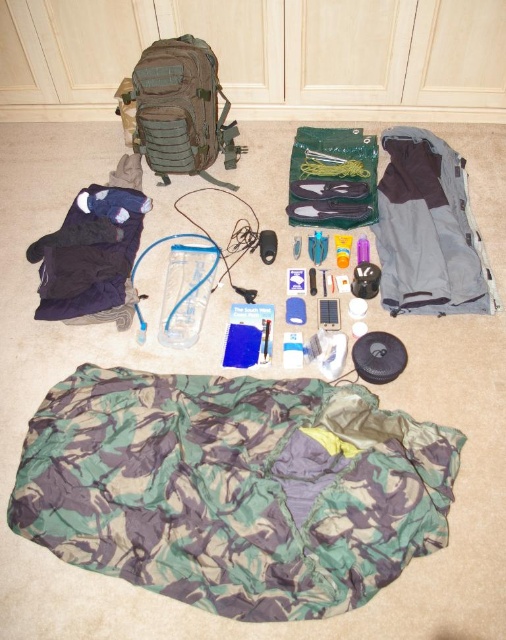
Between gray fabric at upper right and navy blue fleece at lower left, which one appears on the right side from the viewer's perspective?

From the viewer's perspective, gray fabric at upper right appears more on the right side.

Can you confirm if gray fabric at upper right is positioned below navy blue fleece at lower left?

Incorrect, gray fabric at upper right is not positioned below navy blue fleece at lower left.

Describe the element at coordinates (429, 230) in the screenshot. I see `gray fabric at upper right` at that location.

Locate an element on the screen. The height and width of the screenshot is (640, 506). gray fabric at upper right is located at coordinates (429, 230).

Is camouflage fabric sleeping bag at lower center shorter than navy blue fleece at lower left?

Incorrect, camouflage fabric sleeping bag at lower center's height does not fall short of navy blue fleece at lower left's.

Can you confirm if camouflage fabric sleeping bag at lower center is thinner than navy blue fleece at lower left?

Incorrect, camouflage fabric sleeping bag at lower center's width is not less than navy blue fleece at lower left's.

Which is in front, point (258, 614) or point (98, 252)?

Point (258, 614)

The height and width of the screenshot is (640, 506). In order to click on camouflage fabric sleeping bag at lower center in this screenshot , I will do `click(233, 488)`.

Is camouflage fabric sleeping bag at lower center closer to camera compared to camouflage fabric backpack at upper left?

Yes.

Which is above, camouflage fabric sleeping bag at lower center or camouflage fabric backpack at upper left?

camouflage fabric backpack at upper left is higher up.

Find the location of a particular element. camouflage fabric sleeping bag at lower center is located at coordinates (233, 488).